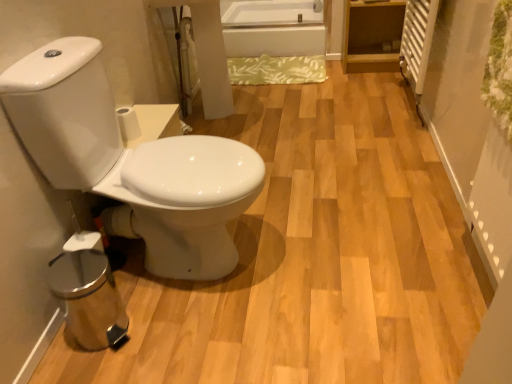
Question: Considering the relative sizes of white glossy toilet at left and white matte toilet paper at center in the image provided, is white glossy toilet at left wider than white matte toilet paper at center?

Choices:
 (A) yes
 (B) no

Answer: (A)

Question: Is white glossy toilet at left behind white matte toilet paper at center?

Choices:
 (A) no
 (B) yes

Answer: (A)

Question: Is white glossy toilet at left to the left of white matte toilet paper at center from the viewer's perspective?

Choices:
 (A) yes
 (B) no

Answer: (B)

Question: Does white glossy toilet at left have a larger size compared to white matte toilet paper at center?

Choices:
 (A) yes
 (B) no

Answer: (A)

Question: Is white glossy toilet at left completely or partially outside of white matte toilet paper at center?

Choices:
 (A) yes
 (B) no

Answer: (A)

Question: Do you think white glossy toilet at left is within white matte toilet paper at center, or outside of it?

Choices:
 (A) inside
 (B) outside

Answer: (B)

Question: Is point (234, 215) closer or farther from the camera than point (138, 134)?

Choices:
 (A) farther
 (B) closer

Answer: (B)

Question: From their relative heights in the image, would you say white glossy toilet at left is taller or shorter than white matte toilet paper at center?

Choices:
 (A) short
 (B) tall

Answer: (B)

Question: In terms of size, does white glossy toilet at left appear bigger or smaller than white matte toilet paper at center?

Choices:
 (A) big
 (B) small

Answer: (A)

Question: Is white glossy bathtub at upper center taller or shorter than white matte toilet paper at center?

Choices:
 (A) tall
 (B) short

Answer: (A)

Question: Is point (318, 23) positioned closer to the camera than point (131, 110)?

Choices:
 (A) closer
 (B) farther

Answer: (B)

Question: In terms of width, does white glossy bathtub at upper center look wider or thinner when compared to white matte toilet paper at center?

Choices:
 (A) thin
 (B) wide

Answer: (B)

Question: Relative to white matte toilet paper at center, is white glossy bathtub at upper center in front or behind?

Choices:
 (A) front
 (B) behind

Answer: (B)

Question: In terms of width, does white matte toilet paper at center look wider or thinner when compared to white glossy toilet at left?

Choices:
 (A) thin
 (B) wide

Answer: (A)

Question: From the image's perspective, relative to white glossy toilet at left, is white matte toilet paper at center above or below?

Choices:
 (A) above
 (B) below

Answer: (A)